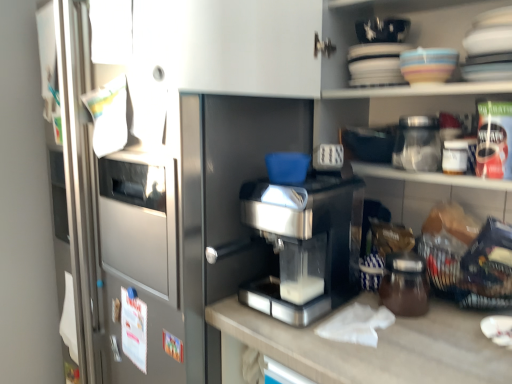
Question: Could you tell me if sleek metallic coffee machine at center is facing brown glass jar at lower right, the second glass jar when ordered from top to bottom?

Choices:
 (A) yes
 (B) no

Answer: (B)

Question: From the image's perspective, is sleek metallic coffee machine at center above brown glass jar at lower right, which is counted as the 1th glass jar, starting from the bottom?

Choices:
 (A) yes
 (B) no

Answer: (A)

Question: From the image's perspective, does sleek metallic coffee machine at center appear lower than brown glass jar at lower right, the second glass jar when ordered from top to bottom?

Choices:
 (A) yes
 (B) no

Answer: (B)

Question: Is sleek metallic coffee machine at center in contact with brown glass jar at lower right, the second glass jar when ordered from top to bottom?

Choices:
 (A) no
 (B) yes

Answer: (A)

Question: Does sleek metallic coffee machine at center have a smaller size compared to brown glass jar at lower right, the second glass jar when ordered from top to bottom?

Choices:
 (A) no
 (B) yes

Answer: (A)

Question: Does sleek metallic coffee machine at center appear on the right side of brown glass jar at lower right, which is counted as the 1th glass jar, starting from the bottom?

Choices:
 (A) yes
 (B) no

Answer: (B)

Question: From a real-world perspective, is sleek metallic coffee machine at center physically above matte ceramic bowl at upper right?

Choices:
 (A) yes
 (B) no

Answer: (B)

Question: Considering the relative positions of sleek metallic coffee machine at center and matte ceramic bowl at upper right in the image provided, is sleek metallic coffee machine at center in front of matte ceramic bowl at upper right?

Choices:
 (A) yes
 (B) no

Answer: (A)

Question: Is sleek metallic coffee machine at center thinner than matte ceramic bowl at upper right?

Choices:
 (A) no
 (B) yes

Answer: (A)

Question: Is sleek metallic coffee machine at center further to the viewer compared to matte ceramic bowl at upper right?

Choices:
 (A) yes
 (B) no

Answer: (B)

Question: From the image's perspective, is sleek metallic coffee machine at center located above matte ceramic bowl at upper right?

Choices:
 (A) yes
 (B) no

Answer: (B)

Question: Can you confirm if sleek metallic coffee machine at center is positioned to the left of matte ceramic bowl at upper right?

Choices:
 (A) yes
 (B) no

Answer: (A)

Question: Does matte ceramic bowl at upper right touch sleek metallic coffee machine at center?

Choices:
 (A) no
 (B) yes

Answer: (A)